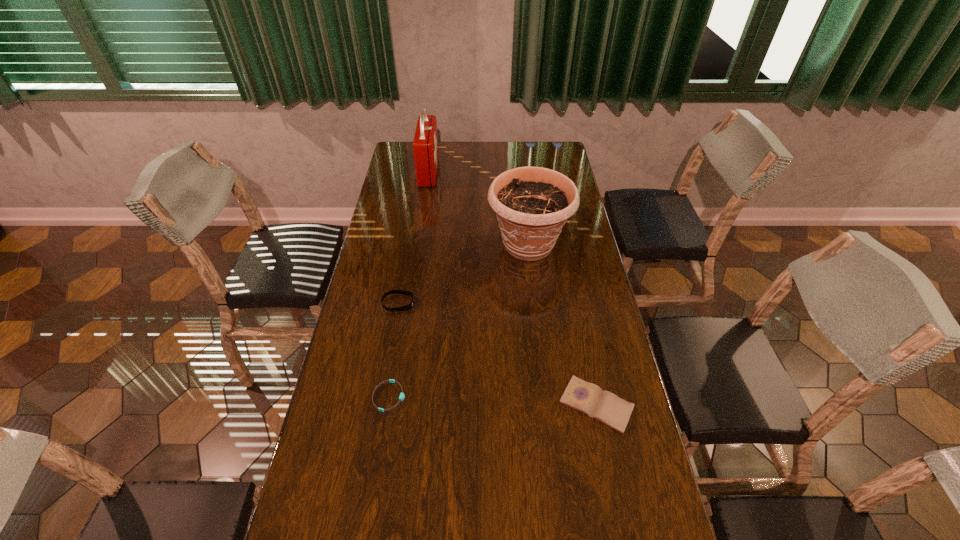
The width and height of the screenshot is (960, 540). Identify the location of vacant space that is in between the second tallest object and the shortest object. (459, 321).

Locate an element on the screen. vacant region between the flowerpot and the fourth tallest object is located at coordinates (563, 325).

Identify the location of object that stands as the second closest to the first-aid kit. (404, 308).

Locate an element on the screen. object that is the closest to the shorter wristband is located at coordinates click(404, 308).

In order to click on free space that satisfies the following two spatial constraints: 1. on the display of the farther wristband; 2. on the back side of the diary in this screenshot , I will do `click(381, 404)`.

Where is `vacant area in the image that satisfies the following two spatial constraints: 1. on the display of the diary; 2. on the left side of the taller wristband`? Image resolution: width=960 pixels, height=540 pixels. vacant area in the image that satisfies the following two spatial constraints: 1. on the display of the diary; 2. on the left side of the taller wristband is located at coordinates (381, 404).

Locate an element on the screen. This screenshot has height=540, width=960. free region that satisfies the following two spatial constraints: 1. on the display of the farther wristband; 2. on the right side of the fourth tallest object is located at coordinates (381, 404).

You are a GUI agent. You are given a task and a screenshot of the screen. Output one action in this format:
    pyautogui.click(x=<x>, y=<y>)
    Task: Click on the vacant space that satisfies the following two spatial constraints: 1. on the display of the taller wristband; 2. on the right side of the second shortest object
    
    Given the screenshot: What is the action you would take?
    pyautogui.click(x=381, y=404)

Where is `vacant space that satisfies the following two spatial constraints: 1. on the back side of the second tallest object; 2. on the front face of the farthest object`? The image size is (960, 540). vacant space that satisfies the following two spatial constraints: 1. on the back side of the second tallest object; 2. on the front face of the farthest object is located at coordinates (519, 172).

Locate an element on the screen. This screenshot has height=540, width=960. vacant space that satisfies the following two spatial constraints: 1. on the back side of the diary; 2. on the front face of the farthest object is located at coordinates (549, 172).